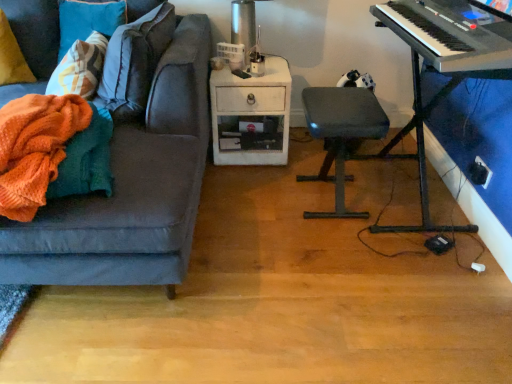
Question: Could you tell me if black plastic keyboard at right is turned towards black plastic keyboard at upper right?

Choices:
 (A) no
 (B) yes

Answer: (A)

Question: From the image's perspective, is black plastic keyboard at right on black plastic keyboard at upper right?

Choices:
 (A) no
 (B) yes

Answer: (A)

Question: Is black plastic keyboard at right bigger than black plastic keyboard at upper right?

Choices:
 (A) yes
 (B) no

Answer: (A)

Question: Is black plastic keyboard at upper right a part of black plastic keyboard at right?

Choices:
 (A) no
 (B) yes

Answer: (A)

Question: Does black plastic keyboard at right come behind black plastic keyboard at upper right?

Choices:
 (A) no
 (B) yes

Answer: (B)

Question: From the image's perspective, relative to black plastic keyboard at upper right, is matte gray stool at center above or below?

Choices:
 (A) below
 (B) above

Answer: (A)

Question: From a real-world perspective, relative to black plastic keyboard at upper right, is matte gray stool at center vertically above or below?

Choices:
 (A) below
 (B) above

Answer: (A)

Question: Is matte gray stool at center spatially inside black plastic keyboard at upper right, or outside of it?

Choices:
 (A) outside
 (B) inside

Answer: (A)

Question: In terms of height, does matte gray stool at center look taller or shorter compared to black plastic keyboard at upper right?

Choices:
 (A) short
 (B) tall

Answer: (B)

Question: In terms of width, does matte gray stool at center look wider or thinner when compared to orange knitted blanket at left?

Choices:
 (A) wide
 (B) thin

Answer: (A)

Question: From the image's perspective, is matte gray stool at center above or below orange knitted blanket at left?

Choices:
 (A) below
 (B) above

Answer: (B)

Question: Is matte gray stool at center situated inside orange knitted blanket at left or outside?

Choices:
 (A) inside
 (B) outside

Answer: (B)

Question: Considering the relative positions of matte gray stool at center and orange knitted blanket at left in the image provided, is matte gray stool at center to the left or to the right of orange knitted blanket at left?

Choices:
 (A) right
 (B) left

Answer: (A)

Question: Is metallic silver table lamp at upper center situated inside black plastic keyboard at upper right or outside?

Choices:
 (A) outside
 (B) inside

Answer: (A)

Question: In terms of height, does metallic silver table lamp at upper center look taller or shorter compared to black plastic keyboard at upper right?

Choices:
 (A) short
 (B) tall

Answer: (B)